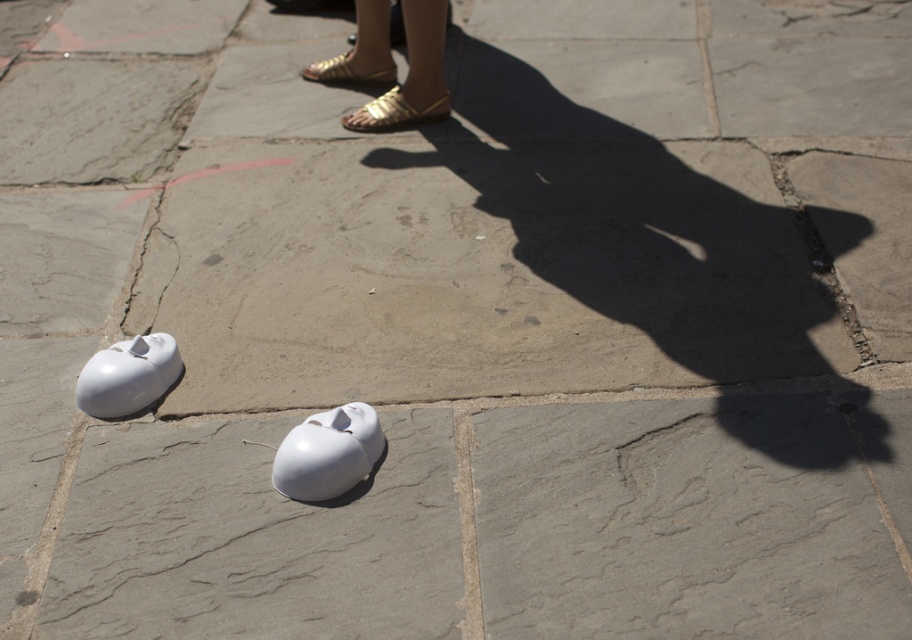
Can you confirm if gold metallic sandals at upper center is positioned above white glossy mouse at center?

Indeed, gold metallic sandals at upper center is positioned over white glossy mouse at center.

Measure the distance between point (x=394, y=90) and camera.

Point (x=394, y=90) and camera are 10.47 feet apart.

This screenshot has height=640, width=912. What are the coordinates of `gold metallic sandals at upper center` in the screenshot? It's located at (412, 74).

Between point (426, 88) and point (144, 352), which one is positioned in front?

Point (144, 352) is in front.

Does gold metallic sandals at upper center have a greater width compared to white matte mouse at lower left?

Yes.

I want to click on gold metallic sandals at upper center, so click(x=412, y=74).

Is point (361, 406) in front of point (117, 349)?

Yes.

Which is more to the right, white glossy mouse at center or white matte mouse at lower left?

white glossy mouse at center is more to the right.

Does point (298, 461) come in front of point (109, 401)?

Yes, it is in front of point (109, 401).

The image size is (912, 640). What are the coordinates of `white glossy mouse at center` in the screenshot? It's located at (327, 452).